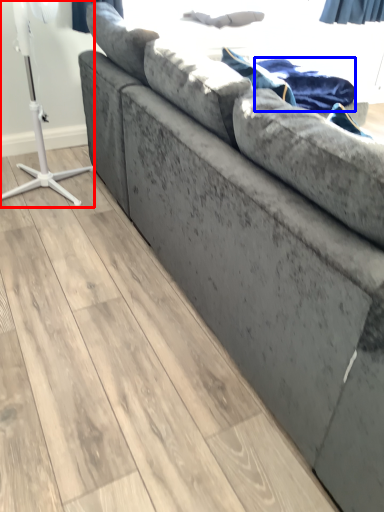
Question: Which of the following is the farthest to the observer, table lamp (highlighted by a red box) or blanket (highlighted by a blue box)?

Choices:
 (A) table lamp
 (B) blanket

Answer: (B)